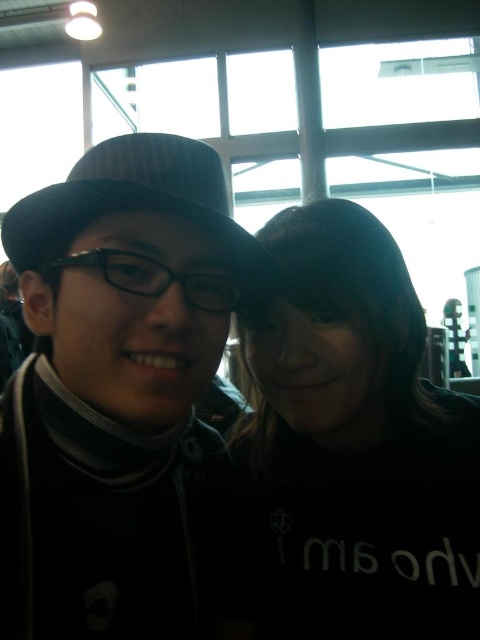
Question: Which point is farther to the camera?

Choices:
 (A) (86, 202)
 (B) (393, 346)

Answer: (B)

Question: Which point appears farthest from the camera in this image?

Choices:
 (A) (154, 166)
 (B) (384, 230)
 (C) (37, 490)

Answer: (B)

Question: From the image, what is the correct spatial relationship of black matte shirt at center in relation to black felt hat at center?

Choices:
 (A) above
 (B) below

Answer: (B)

Question: Is black matte shirt at center behind black felt hat at center?

Choices:
 (A) no
 (B) yes

Answer: (B)

Question: Which point is closer to the camera taking this photo?

Choices:
 (A) (239, 225)
 (B) (334, 493)
 (C) (247, 600)

Answer: (A)

Question: In this image, where is matte black hat at left located relative to black matte shirt at center?

Choices:
 (A) right
 (B) left

Answer: (B)